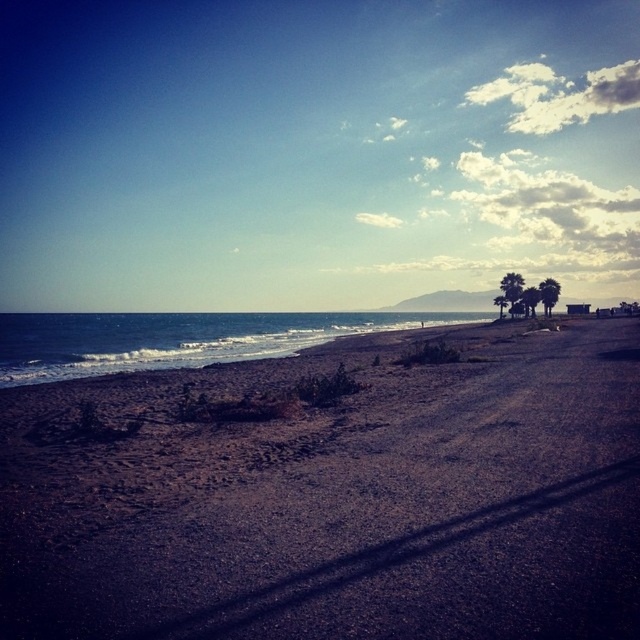
Question: Does dark brown gravel at lower left appear over blue water at lower left?

Choices:
 (A) yes
 (B) no

Answer: (B)

Question: Among these objects, which one is nearest to the camera?

Choices:
 (A) dark brown gravel at lower left
 (B) blue water at lower left

Answer: (A)

Question: Does dark brown gravel at lower left come in front of blue water at lower left?

Choices:
 (A) no
 (B) yes

Answer: (B)

Question: Which point is closer to the camera?

Choices:
 (A) (284, 328)
 (B) (534, 577)

Answer: (B)

Question: Is dark brown gravel at lower left smaller than blue water at lower left?

Choices:
 (A) no
 (B) yes

Answer: (B)